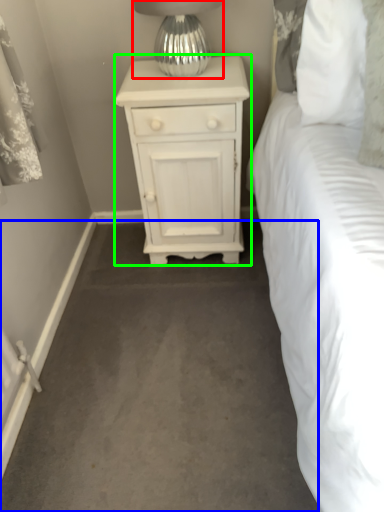
Question: Considering the real-world distances, which object is farthest from table lamp (highlighted by a red box)? concrete (highlighted by a blue box) or nightstand (highlighted by a green box)?

Choices:
 (A) concrete
 (B) nightstand

Answer: (A)